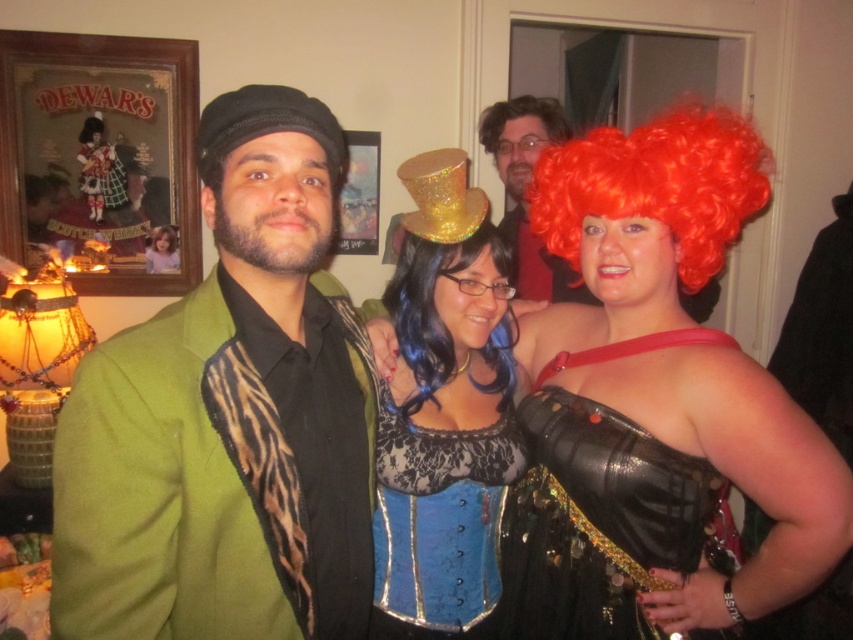
Question: Which object is farther from the camera taking this photo?

Choices:
 (A) bright orange curly wig at upper right
 (B) fluffy red wig at upper center

Answer: (B)

Question: Considering the relative positions of green textured blazer at center and bright orange curly wig at upper right in the image provided, where is green textured blazer at center located with respect to bright orange curly wig at upper right?

Choices:
 (A) right
 (B) left

Answer: (B)

Question: Is shiny red wig at upper right to the left of shiny gold top hat at upper center from the viewer's perspective?

Choices:
 (A) yes
 (B) no

Answer: (B)

Question: Does shiny red wig at upper right have a smaller size compared to blue lace wig at center?

Choices:
 (A) yes
 (B) no

Answer: (B)

Question: Which object appears farthest from the camera in this image?

Choices:
 (A) green textured blazer at center
 (B) fluffy red wig at upper center
 (C) blue lace corset at center
 (D) blue satin corset at center

Answer: (B)

Question: Estimate the real-world distances between objects in this image. Which object is farther from the shiny gold top hat at upper center?

Choices:
 (A) blue lace wig at center
 (B) blue lace corset at center

Answer: (B)